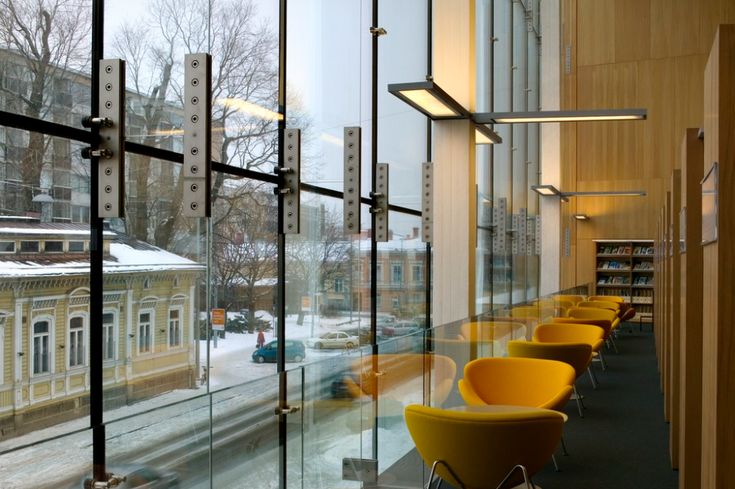
Identify the location of gray floor. The image size is (735, 489). (616, 423).